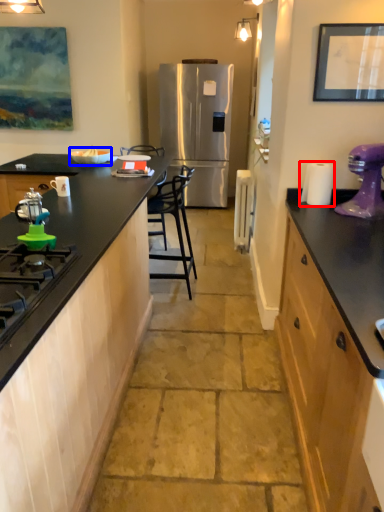
Question: Among these objects, which one is nearest to the camera, paper towel (highlighted by a red box) or appliance (highlighted by a blue box)?

Choices:
 (A) paper towel
 (B) appliance

Answer: (A)